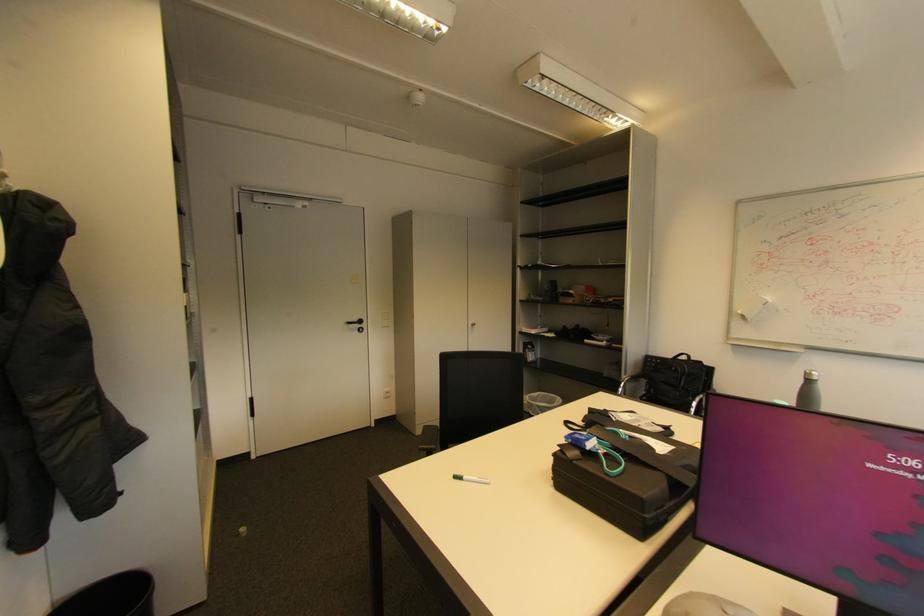
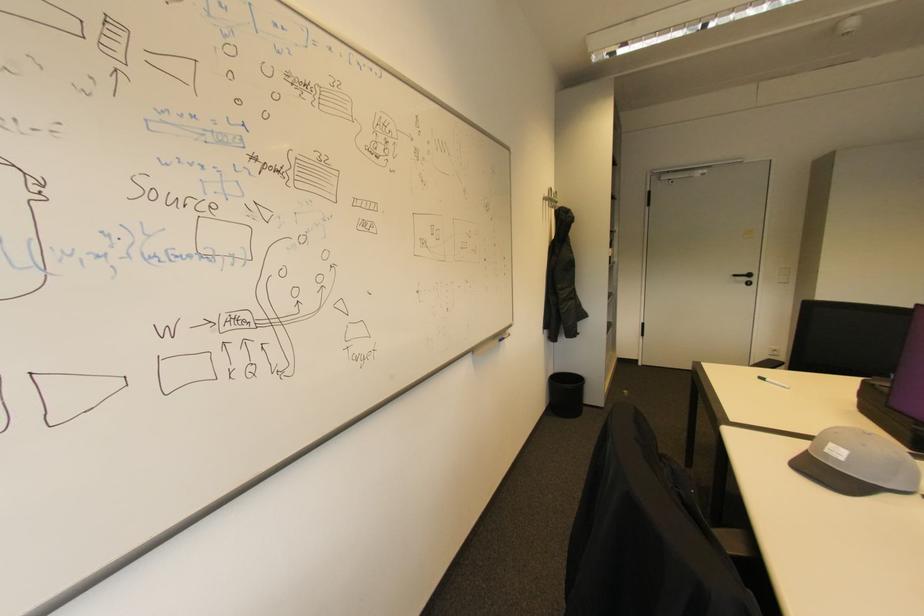
Where in the second image is the point corresponding to pixel 460 477 from the first image?

(768, 379)